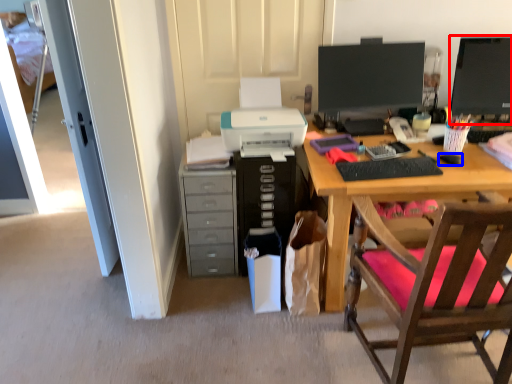
Question: Which of the following is the farthest to the observer, computer monitor (highlighted by a red box) or mouse (highlighted by a blue box)?

Choices:
 (A) computer monitor
 (B) mouse

Answer: (A)